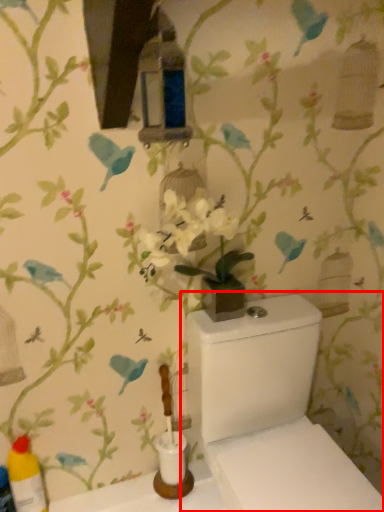
Question: From the image, what is the correct spatial relationship of toilet (annotated by the red box) in relation to bottle?

Choices:
 (A) right
 (B) left

Answer: (A)